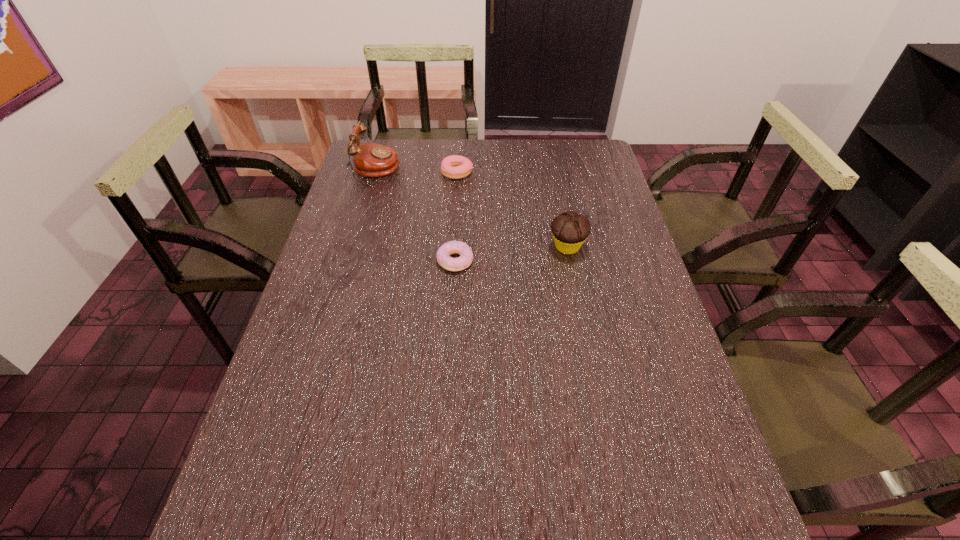
Find the location of `empty space between the farther doughnut and the third shortest object`. empty space between the farther doughnut and the third shortest object is located at coordinates (512, 210).

Locate an element on the screen. This screenshot has width=960, height=540. vacant region between the farther doughnut and the leftmost object is located at coordinates (417, 171).

What are the coordinates of `free point between the muffin and the tallest object` in the screenshot? It's located at (471, 208).

I want to click on free spot between the telephone and the farther doughnut, so click(417, 171).

Where is `blank region between the telephone and the farther doughnut`? This screenshot has width=960, height=540. blank region between the telephone and the farther doughnut is located at coordinates (417, 171).

Locate an element on the screen. Image resolution: width=960 pixels, height=540 pixels. empty space between the telephone and the third shortest object is located at coordinates [471, 208].

Locate an element on the screen. This screenshot has height=540, width=960. vacant space that is in between the farther doughnut and the telephone is located at coordinates (417, 171).

Where is `vacant area that lies between the telephone and the farther doughnut`? This screenshot has width=960, height=540. vacant area that lies between the telephone and the farther doughnut is located at coordinates (417, 171).

Find the location of a particular element. The image size is (960, 540). free space between the rightmost object and the farther doughnut is located at coordinates (512, 210).

At what (x,y) coordinates should I click in order to perform the action: click on object that stands as the closest to the farther doughnut. Please return your answer as a coordinate pair (x, y). Looking at the image, I should click on [x=373, y=160].